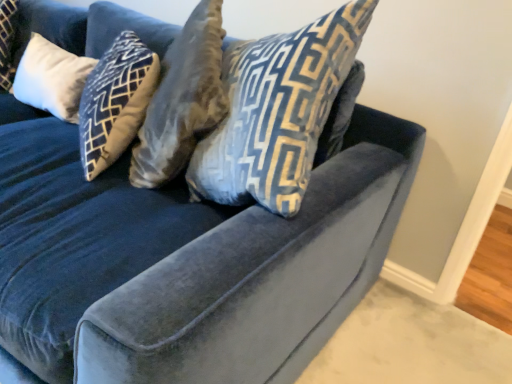
Question: From the image's perspective, is velvet blue pillow at center, which ranks as the 2th pillow in back-to-front order, positioned above or below white soft cushion at upper left, which is the 1th pillow from left to right?

Choices:
 (A) above
 (B) below

Answer: (B)

Question: From a real-world perspective, relative to white soft cushion at upper left, which is the 1th pillow from left to right, is velvet blue pillow at center, the 1th pillow when ordered from right to left, vertically above or below?

Choices:
 (A) below
 (B) above

Answer: (B)

Question: Considering their positions, is velvet blue pillow at center, arranged as the 2th pillow when viewed from the left, located in front of or behind white soft cushion at upper left, which appears as the 2th pillow when viewed from the front?

Choices:
 (A) behind
 (B) front

Answer: (B)

Question: Considering the positions of white soft cushion at upper left, positioned as the first pillow in back-to-front order, and velvet blue pillow at center, the 1th pillow when ordered from right to left, in the image, is white soft cushion at upper left, positioned as the first pillow in back-to-front order, taller or shorter than velvet blue pillow at center, the 1th pillow when ordered from right to left,?

Choices:
 (A) tall
 (B) short

Answer: (B)

Question: From a real-world perspective, is white soft cushion at upper left, which appears as the 2th pillow when viewed from the front, physically located above or below velvet blue pillow at center, which ranks as the 2th pillow in back-to-front order?

Choices:
 (A) above
 (B) below

Answer: (B)

Question: Is white soft cushion at upper left, which is the 1th pillow from left to right, in front of or behind velvet blue pillow at center, which is counted as the 1th pillow, starting from the front, in the image?

Choices:
 (A) behind
 (B) front

Answer: (A)

Question: From the image's perspective, is white soft cushion at upper left, which is the 1th pillow from left to right, located above or below velvet blue pillow at center, the 1th pillow when ordered from right to left?

Choices:
 (A) above
 (B) below

Answer: (A)